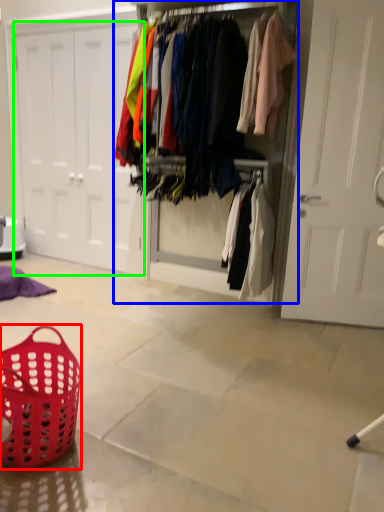
Question: Which is farther away from basket (highlighted by a red box)? closet (highlighted by a blue box) or door (highlighted by a green box)?

Choices:
 (A) closet
 (B) door

Answer: (B)